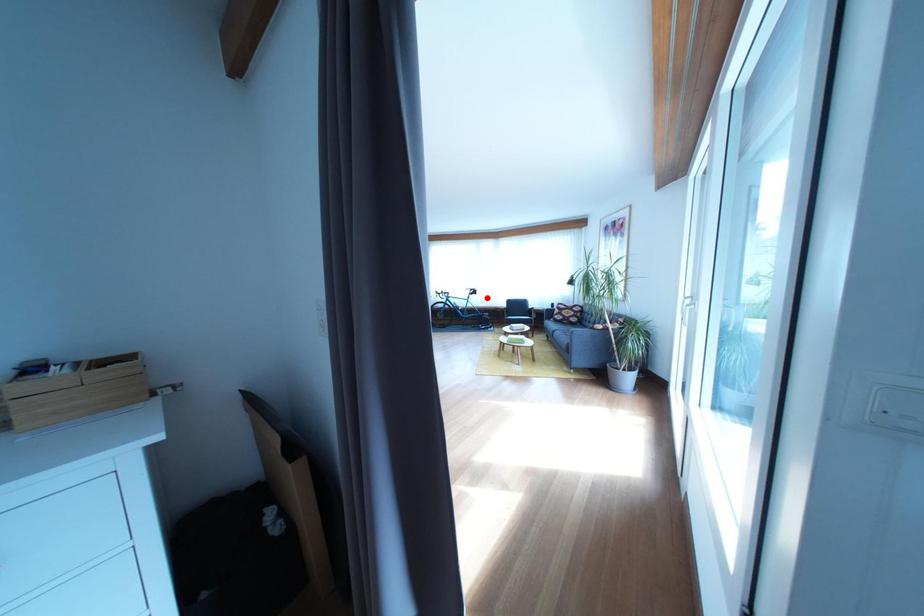
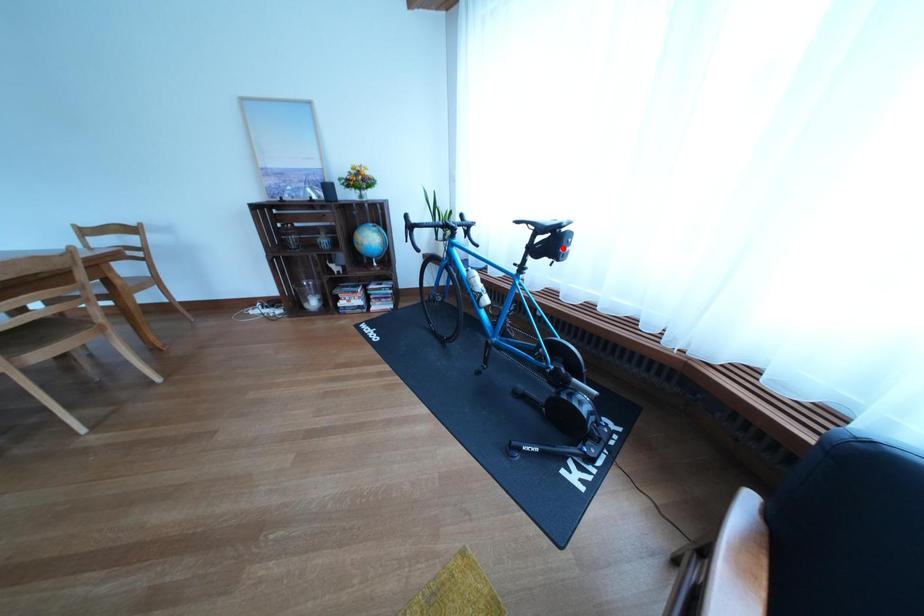
I am providing you with two images of the same scene from different viewpoints. A red point is marked on the first image and another point is marked on the second image. Does the point marked in image1 correspond to the same location as the one in image2?

Yes